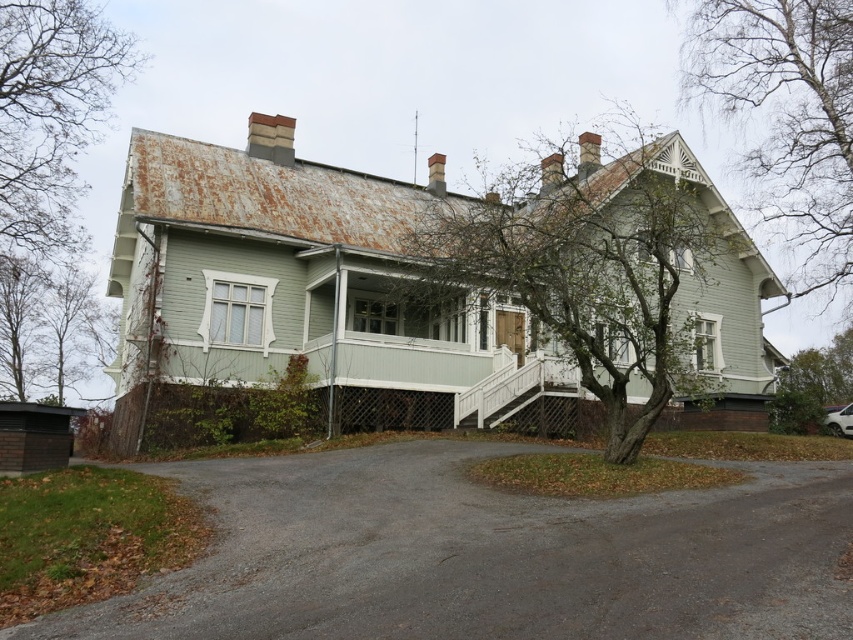
You are a delivery person approaching the house and need to park your vehicle. The gray asphalt driveway at lower center and the bare branches at upper right are visible. Which object should you use as a landmark to locate the driveway?

The gray asphalt driveway at lower center is located below the bare branches at upper right, so you should look for the bare branches at upper right as a landmark to find the driveway below it.